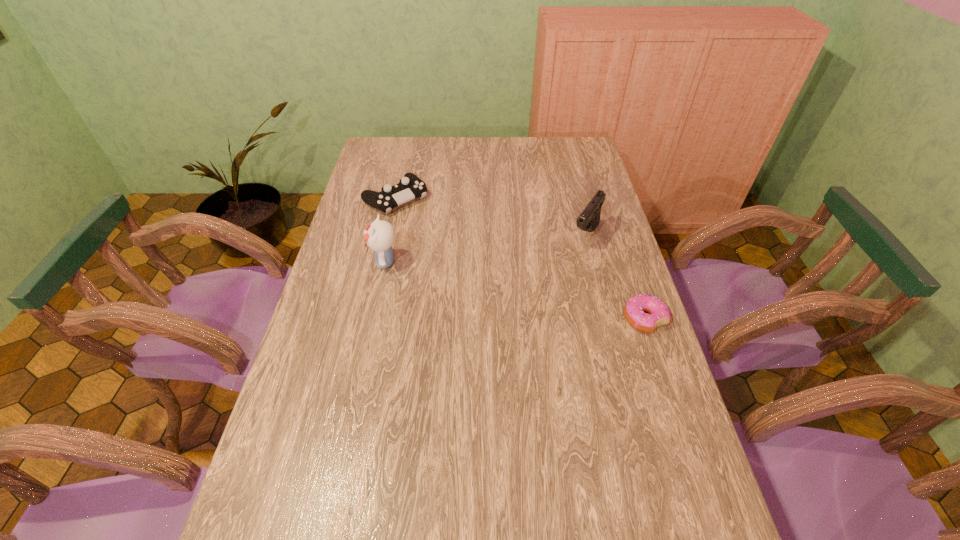
Find the location of a particular element. kitten is located at coordinates (379, 236).

Identify the location of doughnut. (659, 314).

At what (x,y) coordinates should I click in order to perform the action: click on the nearest object. Please return your answer as a coordinate pair (x, y). The height and width of the screenshot is (540, 960). Looking at the image, I should click on (659, 314).

Locate an element on the screen. This screenshot has width=960, height=540. pistol is located at coordinates (588, 220).

I want to click on the second shortest object, so click(x=410, y=187).

Image resolution: width=960 pixels, height=540 pixels. I want to click on control, so click(x=410, y=187).

This screenshot has width=960, height=540. I want to click on vacant space positioned on the front-facing side of the kitten, so click(336, 261).

The height and width of the screenshot is (540, 960). What are the coordinates of `vacant space situated on the front-facing side of the kitten` in the screenshot? It's located at (342, 261).

Where is `vacant area situated on the front of the nearest object`? vacant area situated on the front of the nearest object is located at coordinates (659, 362).

I want to click on blank space located at the barrel of the third shortest object, so click(526, 329).